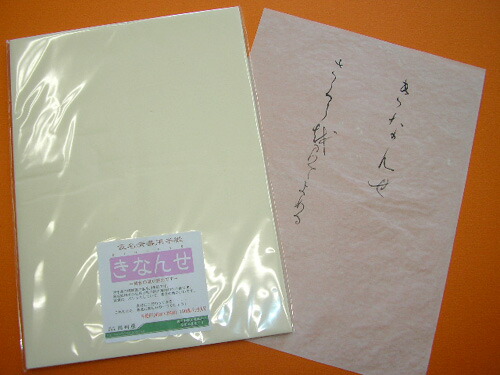
Find the location of a particular element. This screenshot has height=375, width=500. stray sheet of tissue paper is located at coordinates pyautogui.click(x=313, y=220).